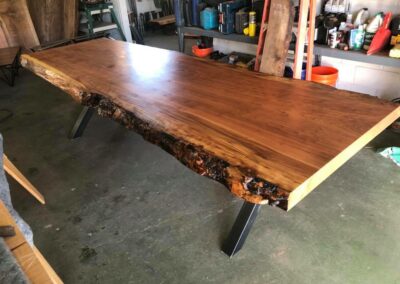
The height and width of the screenshot is (284, 400). I want to click on wood plank, so click(x=283, y=27).